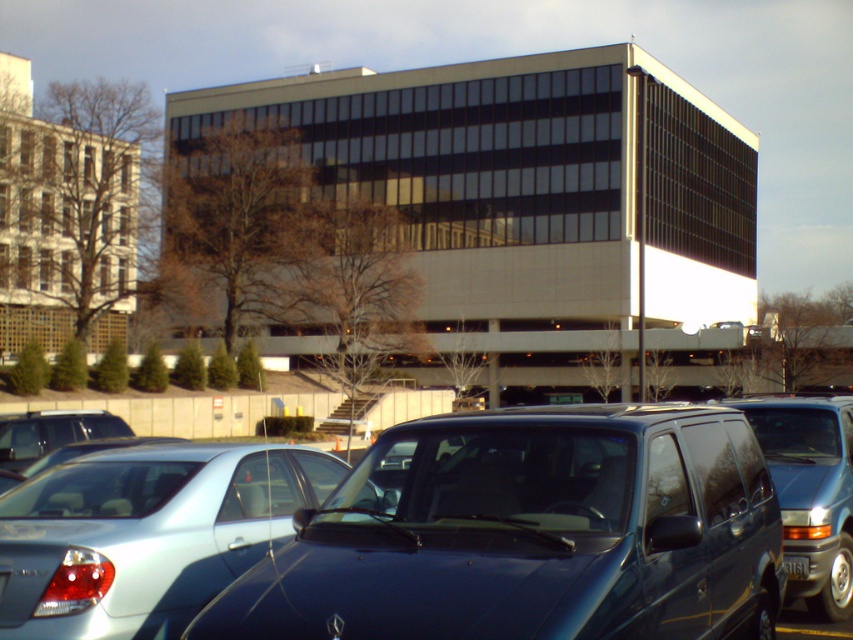
Question: Does satin silver sedan at center have a larger size compared to matte blue van at center?

Choices:
 (A) yes
 (B) no

Answer: (B)

Question: Does glossy dark blue van at center have a greater width compared to silver metallic sedan at center?

Choices:
 (A) no
 (B) yes

Answer: (A)

Question: Does glossy dark blue van at center appear on the left side of matte blue van at center?

Choices:
 (A) no
 (B) yes

Answer: (B)

Question: Among these points, which one is nearest to the camera?

Choices:
 (A) (506, 509)
 (B) (181, 564)
 (C) (747, 404)

Answer: (A)

Question: Among these objects, which one is farthest from the camera?

Choices:
 (A) satin silver sedan at center
 (B) matte blue van at center
 (C) glossy dark blue van at center

Answer: (B)

Question: Which point is closer to the camera?

Choices:
 (A) satin silver sedan at center
 (B) matte blue van at center
 (C) silver metallic sedan at center

Answer: (A)